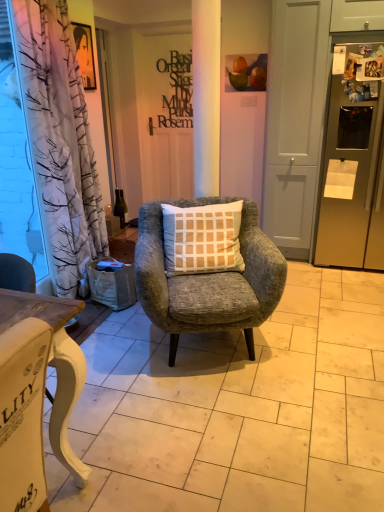
What do you see at coordinates (16, 165) in the screenshot? This screenshot has width=384, height=512. I see `transparent plastic curtain at left` at bounding box center [16, 165].

This screenshot has width=384, height=512. Describe the element at coordinates (120, 207) in the screenshot. I see `green glass bottle at center` at that location.

Find the location of a particular element. The image size is (384, 512). white painted wood desk at lower left is located at coordinates (56, 365).

The height and width of the screenshot is (512, 384). Find the location of `satin gold refrigerator at right`. satin gold refrigerator at right is located at coordinates (352, 160).

The width and height of the screenshot is (384, 512). I want to click on textured gray armchair at center, so click(x=208, y=283).

In order to click on transparent plastic curtain at left in this screenshot , I will do `click(16, 165)`.

Is transparent plastic curtain at left touching matte black sign at center?

No, transparent plastic curtain at left is not making contact with matte black sign at center.

I want to click on window screen in front of the matte black sign at center, so click(x=16, y=165).

How different are the orientations of transparent plastic curtain at left and matte black sign at center in degrees?

There is a 90.7-degree angle between the facing directions of transparent plastic curtain at left and matte black sign at center.

Is transparent plastic curtain at left oriented away from matte black sign at center?

No, transparent plastic curtain at left's orientation is not away from matte black sign at center.

From the picture: Is satin gold refrigerator at right facing towards textured gray armchair at center?

No, satin gold refrigerator at right is not aimed at textured gray armchair at center.

Is satin gold refrigerator at right positioned beyond the bounds of textured gray armchair at center?

Yes, satin gold refrigerator at right is outside of textured gray armchair at center.

Between point (336, 133) and point (162, 236), which one is positioned behind?

The point (336, 133) is more distant.

From the image's perspective, which one is positioned lower, satin gold refrigerator at right or textured gray armchair at center?

textured gray armchair at center.

From a real-world perspective, which object rests below the other?

In real-world perspective, matte gray chair at center is lower.

Could you tell me if white matte screen door at center is turned towards matte gray chair at center?

Yes, white matte screen door at center is turned towards matte gray chair at center.

In the scene shown: From their relative heights in the image, would you say white matte screen door at center is taller or shorter than matte gray chair at center?

In the image, white matte screen door at center appears to be taller than matte gray chair at center.

From a real-world perspective, is matte black sign at center over transparent plastic curtain at left?

Yes, from a real-world perspective, matte black sign at center is above transparent plastic curtain at left.

How much distance is there between matte black sign at center and transparent plastic curtain at left?

A distance of 1.89 meters exists between matte black sign at center and transparent plastic curtain at left.

Considering the relative positions of matte black sign at center and transparent plastic curtain at left in the image provided, is matte black sign at center in front of transparent plastic curtain at left?

No, it is behind transparent plastic curtain at left.

Does point (183, 98) come closer to viewer compared to point (2, 170)?

No, (183, 98) is behind (2, 170).

Is matte black sign at center beside matte gray chair at center?

No, matte black sign at center is not next to matte gray chair at center.

From the image's perspective, would you say matte black sign at center is shown under matte gray chair at center?

No, from the image's perspective, matte black sign at center is not below matte gray chair at center.

Is the position of matte black sign at center more distant than that of matte gray chair at center?

Yes, the depth of matte black sign at center is greater than that of matte gray chair at center.

Considering the sizes of objects matte black sign at center and matte gray chair at center in the image provided, who is bigger, matte black sign at center or matte gray chair at center?

Bigger between the two is matte gray chair at center.

Does transparent plastic curtain at left have a lesser width compared to textured gray armchair at center?

Indeed, transparent plastic curtain at left has a lesser width compared to textured gray armchair at center.

At what (x,y) coordinates should I click in order to perform the action: click on window screen that is behind the textured gray armchair at center. Please return your answer as a coordinate pair (x, y). Looking at the image, I should click on (16, 165).

From a real-world perspective, which is physically below, transparent plastic curtain at left or textured gray armchair at center?

textured gray armchair at center, from a real-world perspective.

From the image's perspective, is transparent plastic curtain at left above or below matte gray chair at center?

Clearly, from the image's perspective, transparent plastic curtain at left is above matte gray chair at center.

This screenshot has width=384, height=512. Find the location of `window screen on the left of matte gray chair at center`. window screen on the left of matte gray chair at center is located at coordinates (16, 165).

Based on the photo, which object is wider, transparent plastic curtain at left or matte gray chair at center?

Wider between the two is matte gray chair at center.

Would you say transparent plastic curtain at left is a long distance from matte gray chair at center?

Yes, transparent plastic curtain at left is far from matte gray chair at center.

Identify the location of window screen that is below the matte black sign at center (from the image's perspective). This screenshot has height=512, width=384. [x=16, y=165].

The height and width of the screenshot is (512, 384). I want to click on refrigerator above the textured gray armchair at center (from the image's perspective), so click(x=352, y=160).

Based on their spatial positions, is textured gray armchair at center or white matte screen door at center further from green glass bottle at center?

white matte screen door at center is further to green glass bottle at center.

Looking at the image, which one is located further to matte black sign at center, matte gray chair at center or textured gray armchair at center?

matte gray chair at center is positioned further to the anchor matte black sign at center.

When comparing their distances from matte gray chair at center, does matte black sign at center or transparent plastic curtain at left seem closer?

Among the two, transparent plastic curtain at left is located nearer to matte gray chair at center.

Based on their spatial positions, is matte gray chair at center or white matte screen door at center closer to matte black sign at center?

white matte screen door at center is positioned closer to the anchor matte black sign at center.

When comparing their distances from transparent plastic curtain at left, does white painted wood desk at lower left or matte gray chair at center seem further?

Based on the image, white painted wood desk at lower left appears to be further to transparent plastic curtain at left.

Based on their spatial positions, is satin gold refrigerator at right or textured gray armchair at center closer to transparent plastic curtain at left?

The object closer to transparent plastic curtain at left is textured gray armchair at center.

Which object lies further to the anchor point transparent plastic curtain at left, satin gold refrigerator at right or green glass bottle at center?

The object further to transparent plastic curtain at left is satin gold refrigerator at right.

From the image, which object appears to be farther from satin gold refrigerator at right, white matte screen door at center or matte black sign at center?

matte black sign at center lies further to satin gold refrigerator at right than the other object.

Identify the location of screen door between textured gray armchair at center and satin gold refrigerator at right from left to right. (294, 121).

Where is `window screen between white painted wood desk at lower left and matte black sign at center from front to back`? This screenshot has width=384, height=512. window screen between white painted wood desk at lower left and matte black sign at center from front to back is located at coordinates (16, 165).

Locate an element on the screen. Image resolution: width=384 pixels, height=512 pixels. refrigerator located between white painted wood desk at lower left and matte black sign at center in the depth direction is located at coordinates (352, 160).

Image resolution: width=384 pixels, height=512 pixels. I want to click on bottle between transparent plastic curtain at left and white matte screen door at center in the horizontal direction, so (x=120, y=207).